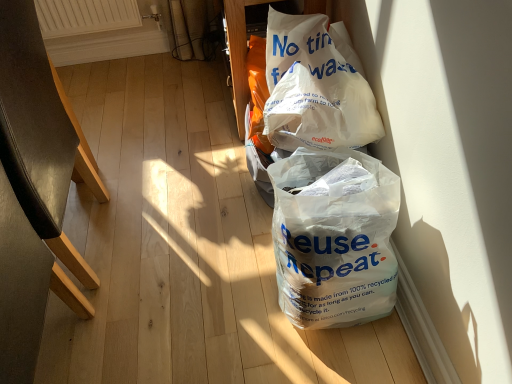
Find the location of a particular element. This screenshot has width=512, height=384. vacant space to the right of black leather chair at left is located at coordinates (195, 236).